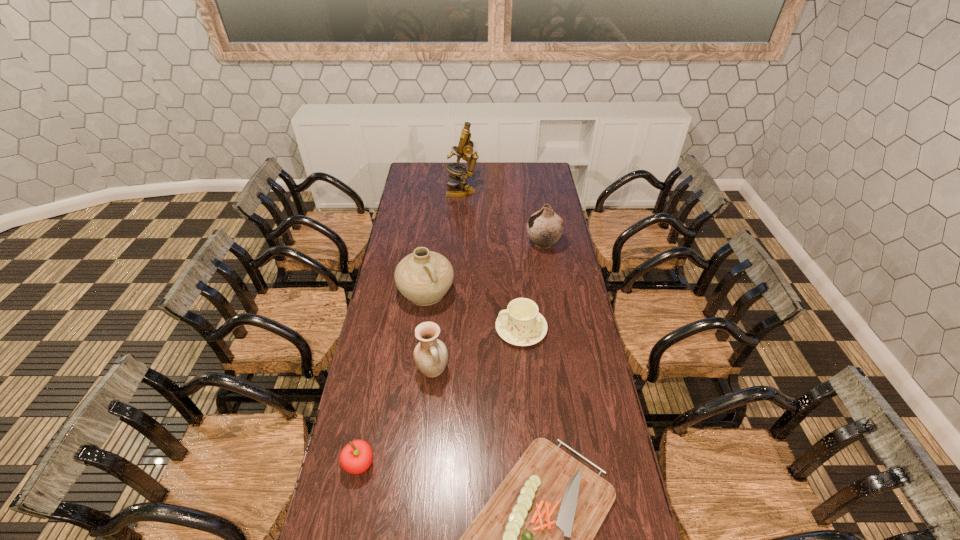
Where is `the farthest object`? This screenshot has width=960, height=540. the farthest object is located at coordinates coord(465,147).

Identify the location of microscope. This screenshot has width=960, height=540. (465, 147).

Find the location of `the second nearest pottery`. the second nearest pottery is located at coordinates (423, 277).

Locate an element on the screen. The image size is (960, 540). the farthest pottery is located at coordinates pos(544,227).

Locate an element on the screen. This screenshot has width=960, height=540. the rightmost pottery is located at coordinates (544, 227).

The height and width of the screenshot is (540, 960). I want to click on the nearest pottery, so click(430, 355).

Where is `chinaware`? chinaware is located at coordinates (521, 324).

This screenshot has height=540, width=960. Identify the location of apple. (356, 457).

Locate an element on the screen. The height and width of the screenshot is (540, 960). vacant space located 0.200m on the front of the tallest object is located at coordinates (461, 220).

This screenshot has height=540, width=960. What are the coordinates of `vacant space located 0.370m on the front of the second farthest pottery` in the screenshot? It's located at (415, 391).